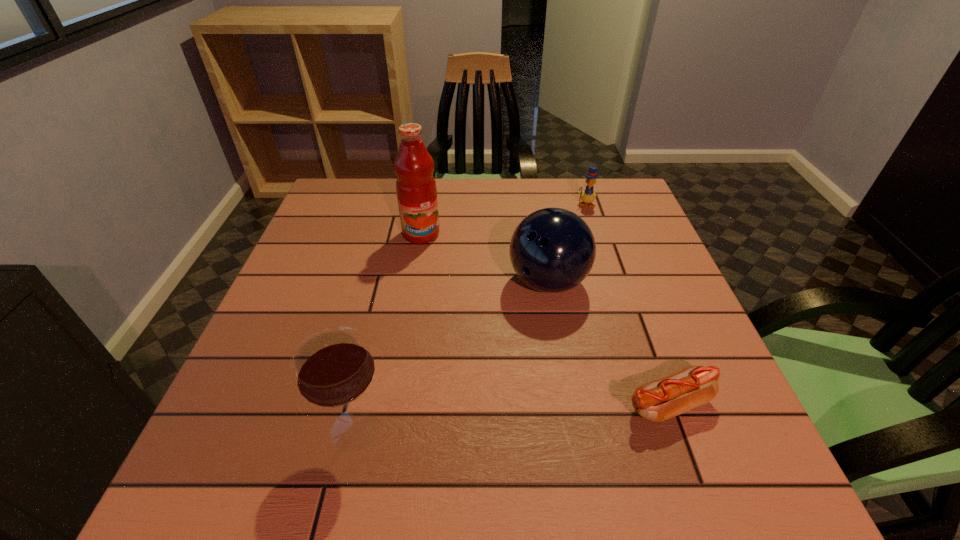
Find the location of a particular element. free space between the fourth nearest object and the sausage is located at coordinates (544, 319).

Identify the location of vacant space that is in between the second farthest object and the third nearest object. (485, 258).

The width and height of the screenshot is (960, 540). I want to click on blank region between the tallest object and the sausage, so click(544, 319).

Where is `unoccupied position between the fruit juice and the third farthest object`? unoccupied position between the fruit juice and the third farthest object is located at coordinates (485, 258).

This screenshot has height=540, width=960. What are the coordinates of `object that stands as the fourth closest to the wineglass` in the screenshot? It's located at (588, 196).

Choose which object is the fourth nearest neighbor to the wineglass. Please provide its 2D coordinates. Your answer should be formatted as a tuple, i.e. [(x, y)], where the tuple contains the x and y coordinates of a point satisfying the conditions above.

[(588, 196)]

Find the location of a particular element. free location that satisfies the following two spatial constraints: 1. on the back side of the bowling ball; 2. on the left side of the wineglass is located at coordinates (389, 282).

The width and height of the screenshot is (960, 540). What are the coordinates of `vacant space that satisfies the following two spatial constraints: 1. on the back side of the wineglass; 2. on the left side of the third farthest object` in the screenshot? It's located at (389, 282).

At what (x,y) coordinates should I click in order to perform the action: click on blank area in the image that satisfies the following two spatial constraints: 1. on the front side of the shortest object; 2. on the left side of the third farthest object. Please return your answer as a coordinate pair (x, y). This screenshot has height=540, width=960. Looking at the image, I should click on (568, 404).

Locate an element on the screen. This screenshot has width=960, height=540. free space that satisfies the following two spatial constraints: 1. on the back side of the duckling; 2. on the right side of the third object from left to right is located at coordinates pos(535,204).